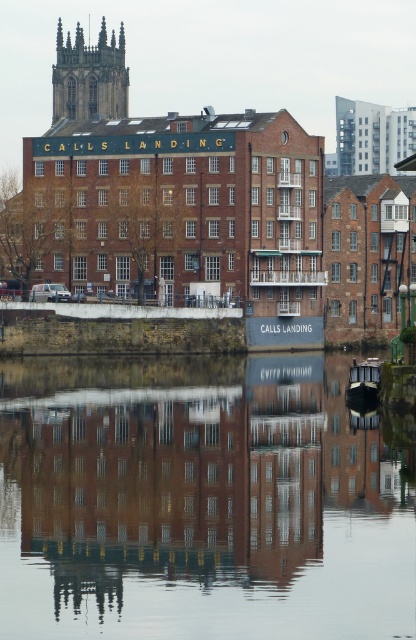
Consider the image. Does smooth water at center have a smaller size compared to dark gray stone tower at upper left?

Actually, smooth water at center might be larger than dark gray stone tower at upper left.

Does point (265, 540) lie behind point (104, 109)?

No, (265, 540) is in front of (104, 109).

Where is `smooth water at center`? This screenshot has height=640, width=416. smooth water at center is located at coordinates (200, 502).